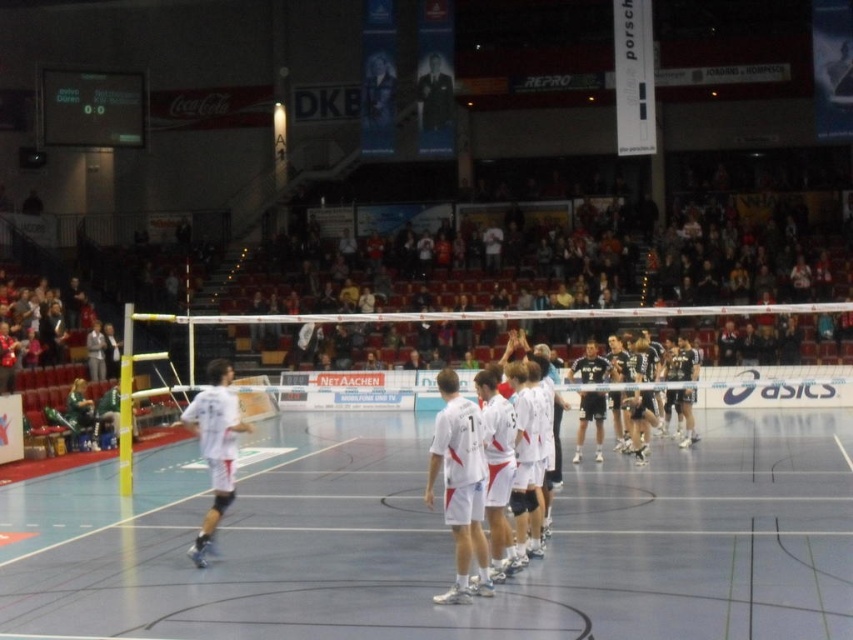
Which is behind, point (495, 429) or point (206, 410)?

The point (206, 410) is behind.

At what (x,y) coordinates should I click in order to perform the action: click on white/red jersey at center. Please return your answer as a coordinate pair (x, y). Looking at the image, I should click on (474, 476).

Identify the location of white/red jersey at center. (474, 476).

Which is behind, point (361, 499) or point (212, 372)?

The point (361, 499) is more distant.

Which is in front, point (375, 573) or point (215, 422)?

Point (375, 573) is in front.

Find the location of a particular element. The width and height of the screenshot is (853, 640). white synthetic court at center is located at coordinates (450, 548).

This screenshot has height=640, width=853. Find the location of `white synthetic court at center`. white synthetic court at center is located at coordinates (450, 548).

Who is positioned more to the left, white synthetic court at center or white/red jersey at center?

white/red jersey at center

Does white synthetic court at center appear over white/red jersey at center?

Actually, white synthetic court at center is below white/red jersey at center.

Which is in front, point (25, 609) or point (502, 445)?

Point (25, 609)

This screenshot has width=853, height=640. Find the location of `white synthetic court at center`. white synthetic court at center is located at coordinates (450, 548).